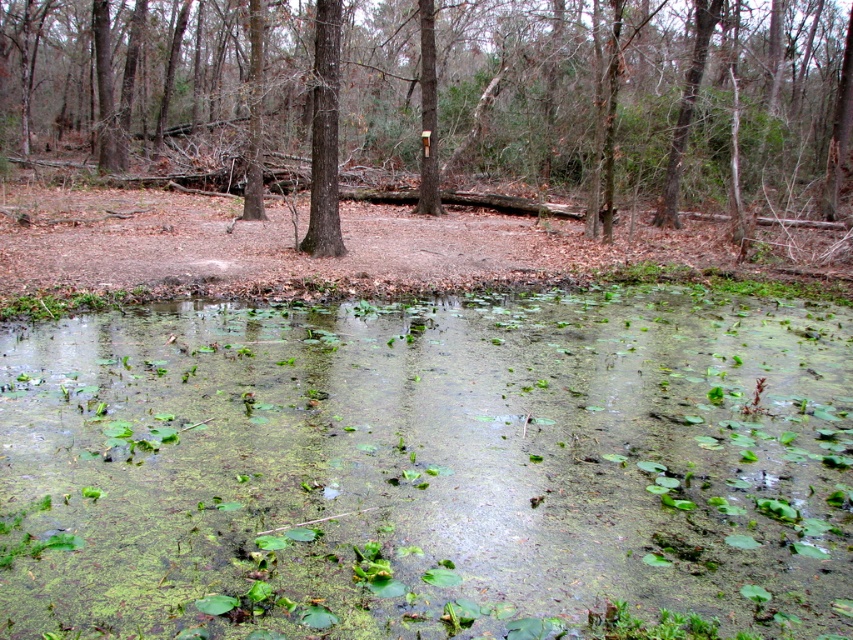
You are standing at the edge of the pond and see two points in the scene. The first point is at coordinates point (202, 145) and the second is at point (320, 236). Which point is closer to you?

Point (202, 145) is further to the camera than point (320, 236), so the point closer to you is point (320, 236).